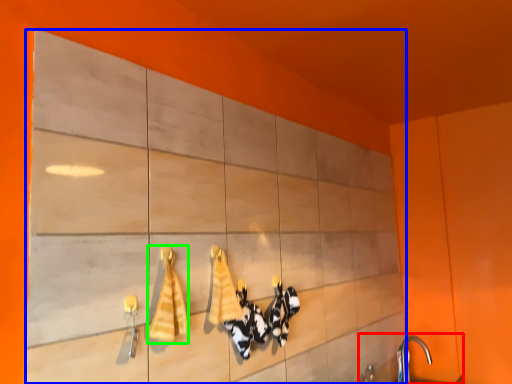
Question: Which object is positioned closest to sink (highlighted by a red box)? Select from cabinetry (highlighted by a blue box) and bath towel (highlighted by a green box).

Choices:
 (A) cabinetry
 (B) bath towel

Answer: (A)